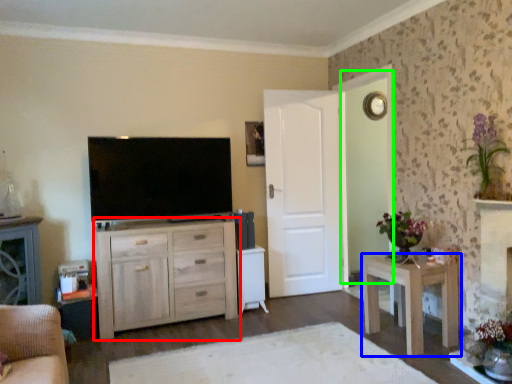
Question: Which object is positioned farthest from chest of drawers (highlighted by a red box)? Select from nightstand (highlighted by a blue box) and glass door (highlighted by a green box).

Choices:
 (A) nightstand
 (B) glass door

Answer: (B)